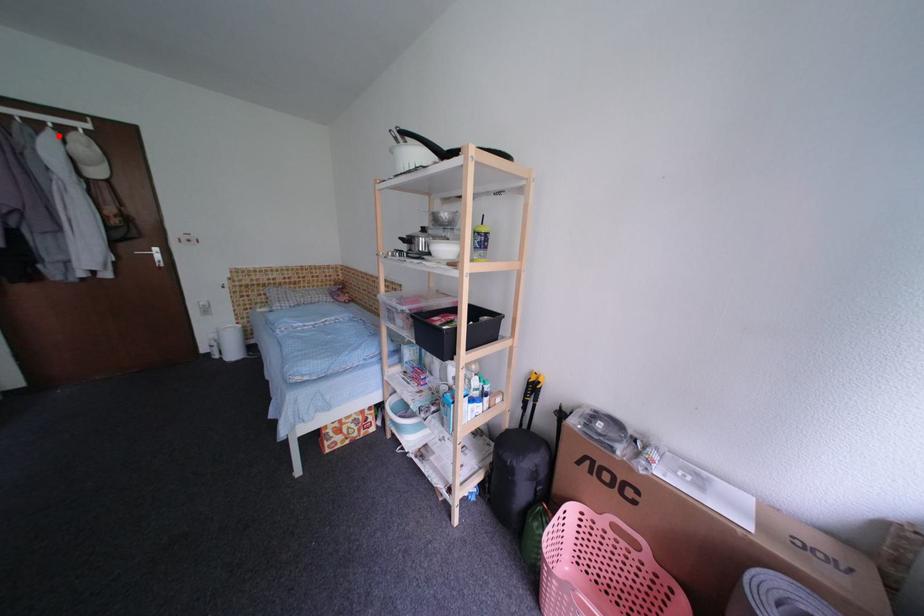
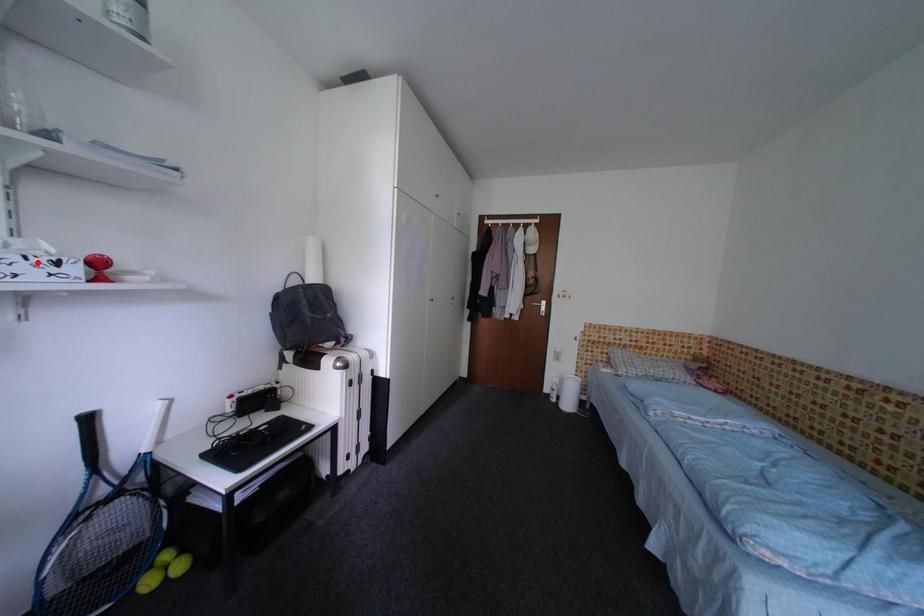
I am providing you with two images of the same scene from different viewpoints. A red point is marked on the first image and another point is marked on the second image. Does the point marked in image1 correspond to the same location as the one in image2?

No